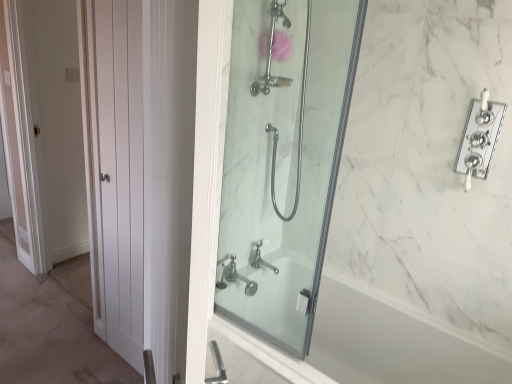
Question: From the image's perspective, is polished chrome faucet at upper right above or below clear glass shower at center?

Choices:
 (A) above
 (B) below

Answer: (A)

Question: Considering the positions of polished chrome faucet at upper right and clear glass shower at center in the image, is polished chrome faucet at upper right taller or shorter than clear glass shower at center?

Choices:
 (A) short
 (B) tall

Answer: (A)

Question: Which object is positioned closest to the white marble bathtub at center?

Choices:
 (A) chrome metallic faucet at center
 (B) polished chrome faucet at upper right
 (C) chrome metallic faucet at lower center
 (D) pink fabric flower at upper center
 (E) clear glass shower at center

Answer: (E)

Question: Estimate the real-world distances between objects in this image. Which object is closer to the clear glass shower at center?

Choices:
 (A) polished chrome faucet at upper right
 (B) chrome metallic faucet at center
 (C) pink fabric flower at upper center
 (D) chrome metallic faucet at lower center
 (E) white marble bathtub at center

Answer: (B)